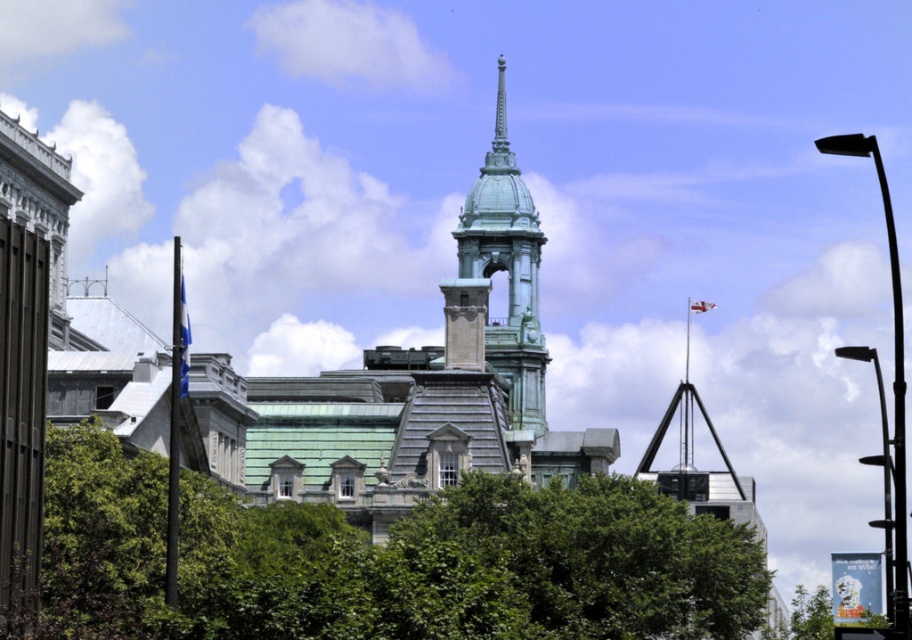
Question: Which point is farther from the camera taking this photo?

Choices:
 (A) (532, 314)
 (B) (192, 593)

Answer: (A)

Question: Is green leafy tree at center positioned behind green patina bell tower at center?

Choices:
 (A) no
 (B) yes

Answer: (A)

Question: Does green leafy tree at center have a larger size compared to green patina bell tower at center?

Choices:
 (A) no
 (B) yes

Answer: (B)

Question: Considering the relative positions of green leafy tree at center and green patina bell tower at center in the image provided, where is green leafy tree at center located with respect to green patina bell tower at center?

Choices:
 (A) left
 (B) right

Answer: (A)